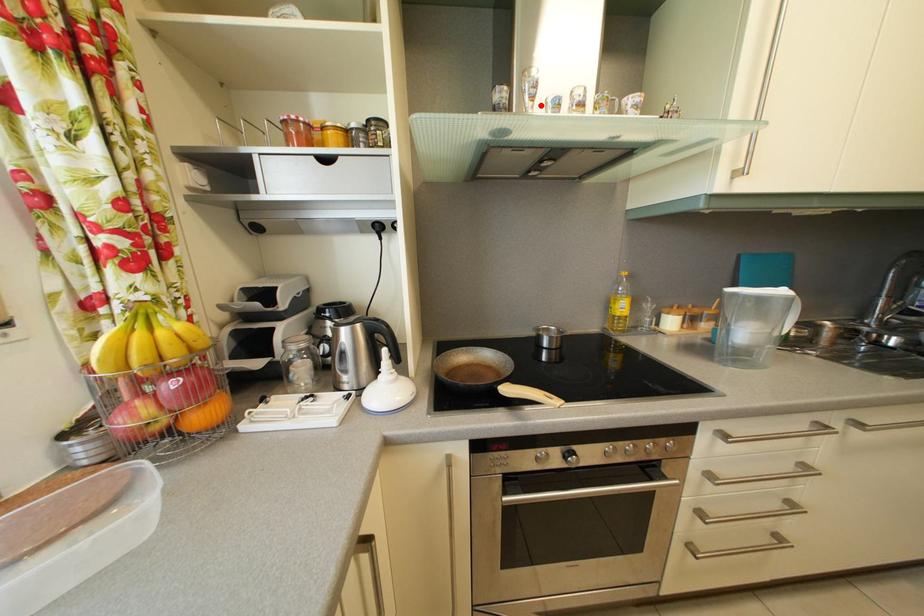
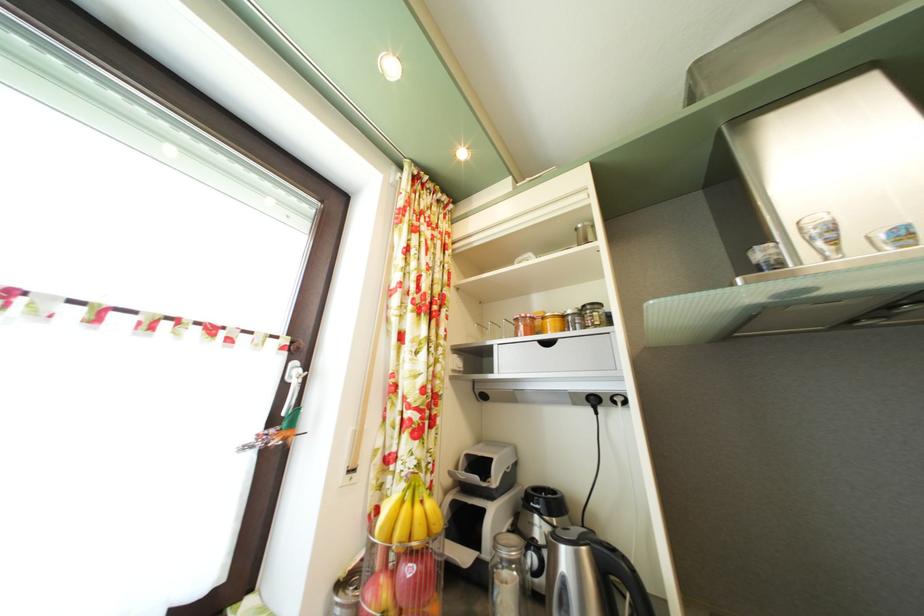
Where in the second image is the point corresponding to the highlighted location from the first image?

(843, 249)